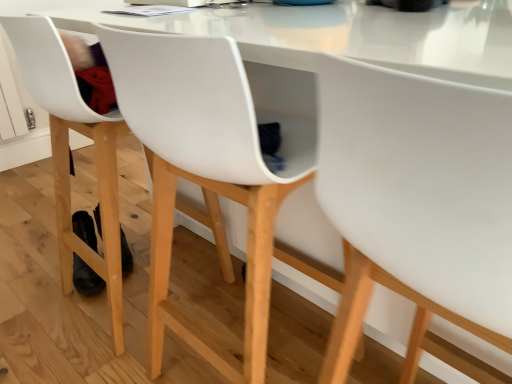
What do you see at coordinates (417, 205) in the screenshot? I see `white matte chair at center, which ranks as the first chair in right-to-left order` at bounding box center [417, 205].

This screenshot has width=512, height=384. Identify the location of white matte chair at center, which is the second chair in left-to-right order. (417, 205).

Identify the location of white matte chair at center, which is counted as the first chair, starting from the left. (67, 154).

How much space does white matte chair at center, placed as the second chair when sorted from right to left, occupy vertically?

35.81 inches.

Describe the element at coordinates (67, 154) in the screenshot. The image size is (512, 384). I see `white matte chair at center, which is counted as the first chair, starting from the left` at that location.

Image resolution: width=512 pixels, height=384 pixels. I want to click on white matte chair at center, which is the second chair in left-to-right order, so [417, 205].

Does white matte chair at center, placed as the second chair when sorted from right to left, appear on the right side of white matte chair at center, which ranks as the first chair in right-to-left order?

Incorrect, white matte chair at center, placed as the second chair when sorted from right to left, is not on the right side of white matte chair at center, which ranks as the first chair in right-to-left order.

Considering the positions of objects white matte chair at center, which is counted as the first chair, starting from the left, and white matte chair at center, which is the second chair in left-to-right order, in the image provided, who is behind, white matte chair at center, which is counted as the first chair, starting from the left, or white matte chair at center, which is the second chair in left-to-right order,?

white matte chair at center, which is counted as the first chair, starting from the left.

Is point (61, 252) less distant than point (336, 319)?

No.

From the image's perspective, which one is positioned lower, white matte chair at center, placed as the second chair when sorted from right to left, or white matte chair at center, which is the second chair in left-to-right order?

white matte chair at center, which is the second chair in left-to-right order, from the image's perspective.

From a real-world perspective, does white matte chair at center, which is counted as the first chair, starting from the left, stand above white matte chair at center, which is the second chair in left-to-right order?

→ No, from a real-world perspective, white matte chair at center, which is counted as the first chair, starting from the left, is not above white matte chair at center, which is the second chair in left-to-right order.

Can you confirm if white matte chair at center, placed as the second chair when sorted from right to left, is wider than white matte chair at center, which ranks as the first chair in right-to-left order?

Correct, the width of white matte chair at center, placed as the second chair when sorted from right to left, exceeds that of white matte chair at center, which ranks as the first chair in right-to-left order.

Which of these two, white matte chair at center, which is counted as the first chair, starting from the left, or white matte chair at center, which ranks as the first chair in right-to-left order, stands shorter?

white matte chair at center, which is counted as the first chair, starting from the left, is shorter.

Considering the sizes of objects white matte chair at center, placed as the second chair when sorted from right to left, and white matte chair at center, which is the second chair in left-to-right order, in the image provided, who is smaller, white matte chair at center, placed as the second chair when sorted from right to left, or white matte chair at center, which is the second chair in left-to-right order,?

Smaller between the two is white matte chair at center, which is the second chair in left-to-right order.

Is white matte chair at center, placed as the second chair when sorted from right to left, located outside white matte chair at center, which is the second chair in left-to-right order?

That's correct, white matte chair at center, placed as the second chair when sorted from right to left, is outside of white matte chair at center, which is the second chair in left-to-right order.

Are white matte chair at center, which is counted as the first chair, starting from the left, and white matte chair at center, which is the second chair in left-to-right order, beside each other?

No, white matte chair at center, which is counted as the first chair, starting from the left, is not beside white matte chair at center, which is the second chair in left-to-right order.

Is white matte chair at center, which is counted as the first chair, starting from the left, oriented towards white matte chair at center, which is the second chair in left-to-right order?

No, white matte chair at center, which is counted as the first chair, starting from the left, is not turned towards white matte chair at center, which is the second chair in left-to-right order.

I want to click on chair above the white matte chair at center, which is the second chair in left-to-right order (from the image's perspective), so click(67, 154).

Considering the relative positions of white matte chair at center, which ranks as the first chair in right-to-left order, and white matte chair at center, placed as the second chair when sorted from right to left, in the image provided, is white matte chair at center, which ranks as the first chair in right-to-left order, to the left of white matte chair at center, placed as the second chair when sorted from right to left, from the viewer's perspective?

No, white matte chair at center, which ranks as the first chair in right-to-left order, is not to the left of white matte chair at center, placed as the second chair when sorted from right to left.

Is white matte chair at center, which is the second chair in left-to-right order, further to the viewer compared to white matte chair at center, which is counted as the first chair, starting from the left?

That is False.

Between point (403, 271) and point (58, 93), which one is positioned behind?

The point (58, 93) is behind.

From the image's perspective, is white matte chair at center, which is the second chair in left-to-right order, on top of white matte chair at center, placed as the second chair when sorted from right to left?

No, from the image's perspective, white matte chair at center, which is the second chair in left-to-right order, is not on top of white matte chair at center, placed as the second chair when sorted from right to left.

From a real-world perspective, which is physically below, white matte chair at center, which ranks as the first chair in right-to-left order, or white matte chair at center, which is counted as the first chair, starting from the left?

white matte chair at center, which is counted as the first chair, starting from the left.

Can you confirm if white matte chair at center, which is the second chair in left-to-right order, is wider than white matte chair at center, which is counted as the first chair, starting from the left?

In fact, white matte chair at center, which is the second chair in left-to-right order, might be narrower than white matte chair at center, which is counted as the first chair, starting from the left.

Who is taller, white matte chair at center, which ranks as the first chair in right-to-left order, or white matte chair at center, which is counted as the first chair, starting from the left?

Standing taller between the two is white matte chair at center, which ranks as the first chair in right-to-left order.

Who is smaller, white matte chair at center, which is the second chair in left-to-right order, or white matte chair at center, placed as the second chair when sorted from right to left?

white matte chair at center, which is the second chair in left-to-right order, is smaller.

Is white matte chair at center, which ranks as the first chair in right-to-left order, spatially inside white matte chair at center, which is counted as the first chair, starting from the left, or outside of it?

white matte chair at center, which ranks as the first chair in right-to-left order, is not enclosed by white matte chair at center, which is counted as the first chair, starting from the left.

Are white matte chair at center, which is the second chair in left-to-right order, and white matte chair at center, which is counted as the first chair, starting from the left, located far from each other?

No.

Could you tell me if white matte chair at center, which is the second chair in left-to-right order, is facing white matte chair at center, which is counted as the first chair, starting from the left?

No, white matte chair at center, which is the second chair in left-to-right order, is not turned towards white matte chair at center, which is counted as the first chair, starting from the left.

This screenshot has height=384, width=512. In order to click on chair on the right side of white matte chair at center, placed as the second chair when sorted from right to left in this screenshot , I will do `click(417, 205)`.

Find the location of a particular element. chair that is on the right side of white matte chair at center, which is counted as the first chair, starting from the left is located at coordinates (417, 205).

The width and height of the screenshot is (512, 384). Identify the location of chair above the white matte chair at center, which is the second chair in left-to-right order (from the image's perspective). (67, 154).